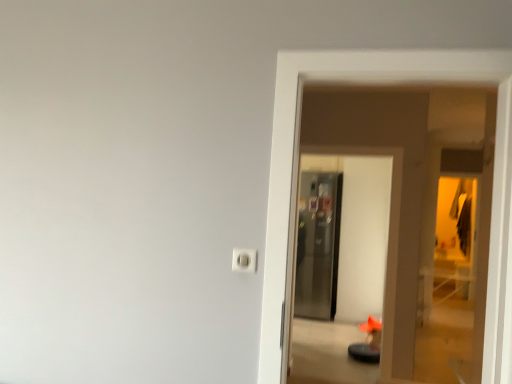
Question: In which direction should I rotate to look at satin metallic refrigerator at center, which is counted as the second screen door, starting from the back?

Choices:
 (A) left
 (B) right

Answer: (B)

Question: Is metallic glass screen door at center, which appears as the second screen door when viewed from the front, oriented away from white plastic outlet at center?

Choices:
 (A) yes
 (B) no

Answer: (B)

Question: Is metallic glass screen door at center, which appears as the second screen door when viewed from the front, facing towards white plastic outlet at center?

Choices:
 (A) yes
 (B) no

Answer: (A)

Question: From the image's perspective, is metallic glass screen door at center, which appears as the second screen door when viewed from the front, located beneath white plastic outlet at center?

Choices:
 (A) yes
 (B) no

Answer: (A)

Question: Does metallic glass screen door at center, arranged as the first screen door when viewed from the back, have a greater width compared to white plastic outlet at center?

Choices:
 (A) yes
 (B) no

Answer: (A)

Question: From a real-world perspective, is metallic glass screen door at center, arranged as the first screen door when viewed from the back, under white plastic outlet at center?

Choices:
 (A) no
 (B) yes

Answer: (B)

Question: Does metallic glass screen door at center, which appears as the second screen door when viewed from the front, touch white plastic outlet at center?

Choices:
 (A) yes
 (B) no

Answer: (B)

Question: From a real-world perspective, does satin metallic refrigerator at center, placed as the 1th screen door when sorted from front to back, sit lower than white plastic outlet at center?

Choices:
 (A) no
 (B) yes

Answer: (B)

Question: From the image's perspective, would you say satin metallic refrigerator at center, placed as the 1th screen door when sorted from front to back, is positioned over white plastic outlet at center?

Choices:
 (A) no
 (B) yes

Answer: (A)

Question: Can you confirm if satin metallic refrigerator at center, which is counted as the second screen door, starting from the back, is bigger than white plastic outlet at center?

Choices:
 (A) no
 (B) yes

Answer: (B)

Question: Can white plastic outlet at center be found inside satin metallic refrigerator at center, placed as the 1th screen door when sorted from front to back?

Choices:
 (A) no
 (B) yes

Answer: (A)

Question: Does satin metallic refrigerator at center, which is counted as the second screen door, starting from the back, have a lesser width compared to white plastic outlet at center?

Choices:
 (A) no
 (B) yes

Answer: (A)

Question: Is satin metallic refrigerator at center, placed as the 1th screen door when sorted from front to back, positioned behind white plastic outlet at center?

Choices:
 (A) yes
 (B) no

Answer: (A)

Question: Considering the relative sizes of satin metallic refrigerator at center, placed as the 1th screen door when sorted from front to back, and metallic glass screen door at center, which appears as the second screen door when viewed from the front, in the image provided, is satin metallic refrigerator at center, placed as the 1th screen door when sorted from front to back, wider than metallic glass screen door at center, which appears as the second screen door when viewed from the front,?

Choices:
 (A) no
 (B) yes

Answer: (A)